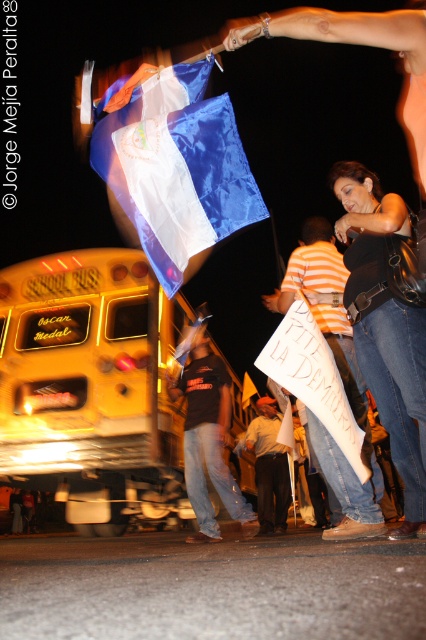
Question: Which of these objects is positioned closest to the white paper sign at lower center?

Choices:
 (A) dark blue jeans at center
 (B) denim jeans at center
 (C) black matte shirt at center
 (D) shiny blue and white flag at upper center

Answer: (B)

Question: Does yellow matte school bus at lower left lie in front of white paper sign at center?

Choices:
 (A) no
 (B) yes

Answer: (A)

Question: Is yellow matte school bus at lower left smaller than denim jeans at center?

Choices:
 (A) no
 (B) yes

Answer: (A)

Question: Which object appears closest to the camera in this image?

Choices:
 (A) denim jeans at center
 (B) white paper sign at center

Answer: (B)

Question: Estimate the real-world distances between objects in this image. Which object is farther from the white paper sign at lower center?

Choices:
 (A) shiny blue and white flag at upper center
 (B) white paper sign at center
 (C) black matte shirt at center

Answer: (C)

Question: Can you confirm if white paper sign at lower center is positioned above white paper sign at center?

Choices:
 (A) no
 (B) yes

Answer: (B)